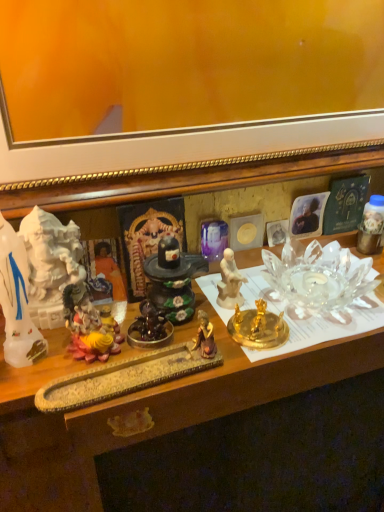
This screenshot has height=512, width=384. What are the coordinates of `free location to the right of matte white statue at center, the 2th person viewed from the left` in the screenshot? It's located at (331, 307).